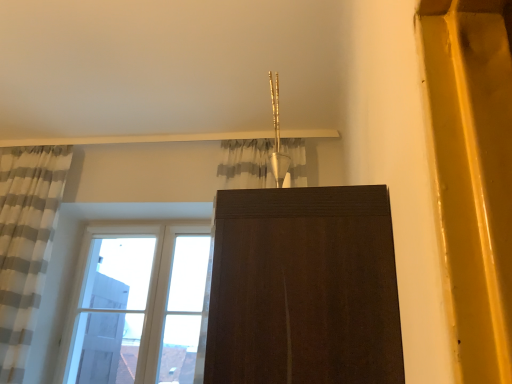
Question: From a real-world perspective, is white striped fabric at left above or below clear glass window at lower left?

Choices:
 (A) below
 (B) above

Answer: (B)

Question: Considering their positions, is white striped fabric at left located in front of or behind clear glass window at lower left?

Choices:
 (A) front
 (B) behind

Answer: (A)

Question: Based on their sizes in the image, would you say white striped fabric at left is bigger or smaller than clear glass window at lower left?

Choices:
 (A) big
 (B) small

Answer: (A)

Question: Looking at their shapes, would you say clear glass window at lower left is wider or thinner than white striped fabric at left?

Choices:
 (A) wide
 (B) thin

Answer: (B)

Question: Relative to white striped fabric at left, is clear glass window at lower left in front or behind?

Choices:
 (A) behind
 (B) front

Answer: (A)

Question: Based on their positions, is clear glass window at lower left located to the left or right of white striped fabric at left?

Choices:
 (A) left
 (B) right

Answer: (B)

Question: Does point pos(147,228) appear closer or farther from the camera than point pos(29,193)?

Choices:
 (A) farther
 (B) closer

Answer: (A)